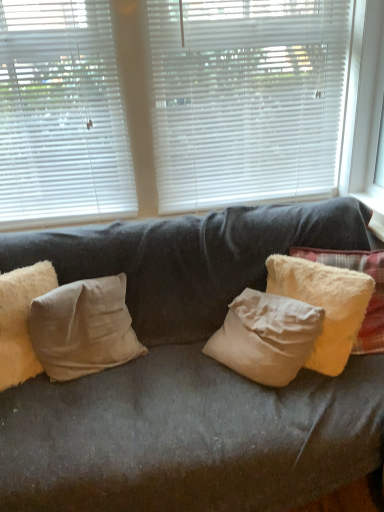
Question: From a real-world perspective, is white matte blinds at upper left, which is counted as the second window blind, starting from the right, located beneath fuzzy yellow pillow at right, acting as the 3th pillow starting from the left?

Choices:
 (A) no
 (B) yes

Answer: (A)

Question: From the image's perspective, is white matte blinds at upper left, which is counted as the second window blind, starting from the right, above fuzzy yellow pillow at right, the 1th pillow when ordered from right to left?

Choices:
 (A) no
 (B) yes

Answer: (B)

Question: Is white matte blinds at upper left, the 1th window blind when ordered from left to right, facing towards fuzzy yellow pillow at right, acting as the 3th pillow starting from the left?

Choices:
 (A) yes
 (B) no

Answer: (B)

Question: Is white matte blinds at upper left, the 1th window blind when ordered from left to right, wider than fuzzy yellow pillow at right, the 1th pillow when ordered from right to left?

Choices:
 (A) no
 (B) yes

Answer: (A)

Question: Does white matte blinds at upper left, which is counted as the second window blind, starting from the right, appear on the right side of fuzzy yellow pillow at right, the 1th pillow when ordered from right to left?

Choices:
 (A) yes
 (B) no

Answer: (B)

Question: From the image's perspective, does white matte blinds at upper left, the 1th window blind when ordered from left to right, appear lower than fuzzy yellow pillow at right, the 1th pillow when ordered from right to left?

Choices:
 (A) no
 (B) yes

Answer: (A)

Question: Considering the relative sizes of fuzzy yellow pillow at right, the 1th pillow when ordered from right to left, and beige cotton pillow at left, the 2th pillow from the left, in the image provided, is fuzzy yellow pillow at right, the 1th pillow when ordered from right to left, wider than beige cotton pillow at left, the 2th pillow from the left,?

Choices:
 (A) no
 (B) yes

Answer: (B)

Question: Are fuzzy yellow pillow at right, acting as the 3th pillow starting from the left, and beige cotton pillow at left, the 2th pillow from the left, located far from each other?

Choices:
 (A) no
 (B) yes

Answer: (A)

Question: Does fuzzy yellow pillow at right, the 1th pillow when ordered from right to left, have a larger size compared to beige cotton pillow at left, the 2th pillow from the left?

Choices:
 (A) no
 (B) yes

Answer: (B)

Question: From the image's perspective, is fuzzy yellow pillow at right, acting as the 3th pillow starting from the left, above beige cotton pillow at left, the 2th pillow from the left?

Choices:
 (A) no
 (B) yes

Answer: (B)

Question: From the image's perspective, would you say fuzzy yellow pillow at right, the 1th pillow when ordered from right to left, is shown under beige cotton pillow at left, the 2th pillow from the left?

Choices:
 (A) no
 (B) yes

Answer: (A)

Question: Can you confirm if fuzzy yellow pillow at right, the 1th pillow when ordered from right to left, is thinner than beige cotton pillow at left, the 2th pillow from the left?

Choices:
 (A) yes
 (B) no

Answer: (B)

Question: Considering the relative positions of white plastic window frame at upper right and white matte blinds at upper left, the 1th window blind when ordered from left to right, in the image provided, is white plastic window frame at upper right in front of white matte blinds at upper left, the 1th window blind when ordered from left to right,?

Choices:
 (A) no
 (B) yes

Answer: (B)